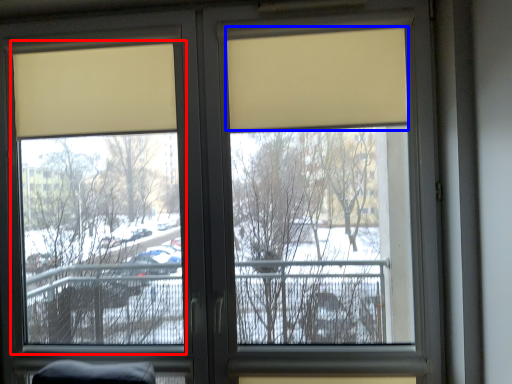
Question: Among these objects, which one is nearest to the camera, window screen (highlighted by a red box) or curtain (highlighted by a blue box)?

Choices:
 (A) window screen
 (B) curtain

Answer: (B)